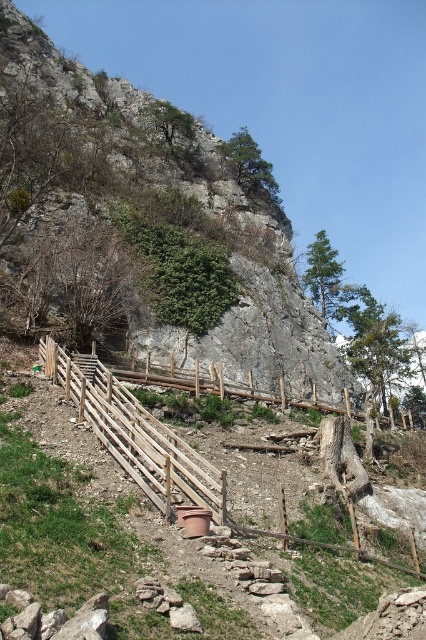
Question: Can you confirm if rough stone hill at center is thinner than wooden fence at lower center?

Choices:
 (A) no
 (B) yes

Answer: (A)

Question: Which object is positioned farthest from the wooden fence at center?

Choices:
 (A) wooden fence at lower center
 (B) rough stone hill at center

Answer: (B)

Question: Which point is closer to the camera?

Choices:
 (A) (279, 339)
 (B) (181, 372)
 (C) (146, 460)

Answer: (C)

Question: Does wooden fence at lower center appear over wooden fence at center?

Choices:
 (A) yes
 (B) no

Answer: (B)

Question: Which is farther from the rough stone hill at center?

Choices:
 (A) wooden fence at center
 (B) wooden fence at lower center

Answer: (B)

Question: Where is wooden fence at lower center located in relation to wooden fence at center in the image?

Choices:
 (A) left
 (B) right

Answer: (A)